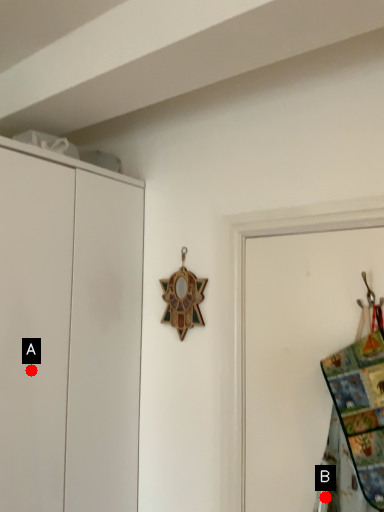
Question: Two points are circled on the image, labeled by A and B beside each circle. Which point appears farthest from the camera in this image?

Choices:
 (A) A is further
 (B) B is further

Answer: (A)